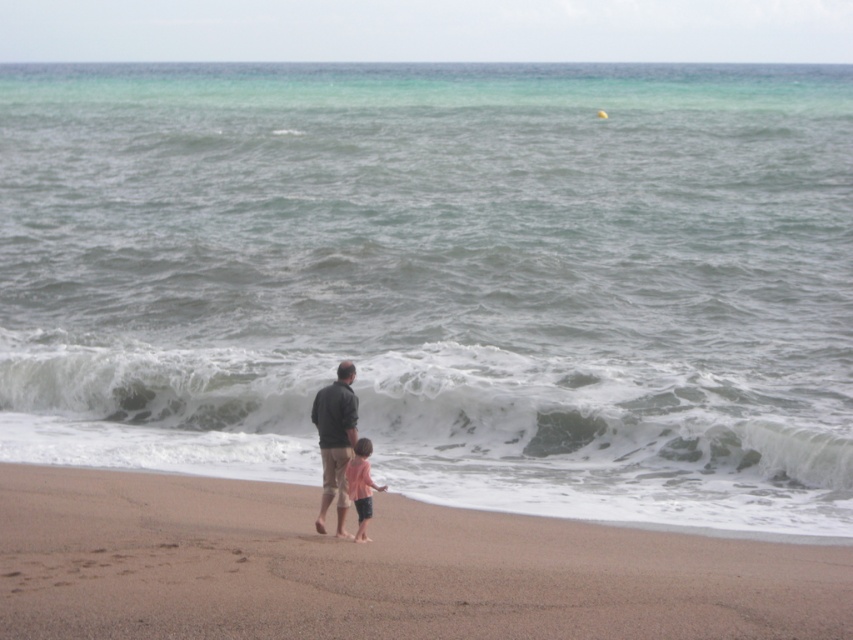
Which is more to the right, dark gray jacket at center or pink fabric shirt at lower center?

From the viewer's perspective, pink fabric shirt at lower center appears more on the right side.

Which is below, dark gray jacket at center or pink fabric shirt at lower center?

pink fabric shirt at lower center is below.

Between point (343, 419) and point (366, 470), which one is positioned in front?

Point (366, 470) is more forward.

This screenshot has width=853, height=640. I want to click on dark gray jacket at center, so click(335, 442).

Is brown sandy beach at lower center positioned before dark gray jacket at center?

Yes, brown sandy beach at lower center is closer to the viewer.

Locate an element on the screen. brown sandy beach at lower center is located at coordinates (376, 568).

Find the location of a particular element. The width and height of the screenshot is (853, 640). brown sandy beach at lower center is located at coordinates (376, 568).

Image resolution: width=853 pixels, height=640 pixels. Describe the element at coordinates (376, 568) in the screenshot. I see `brown sandy beach at lower center` at that location.

Can you confirm if brown sandy beach at lower center is positioned to the right of pink fabric shirt at lower center?

Indeed, brown sandy beach at lower center is positioned on the right side of pink fabric shirt at lower center.

Find the location of a particular element. This screenshot has width=853, height=640. brown sandy beach at lower center is located at coordinates 376,568.